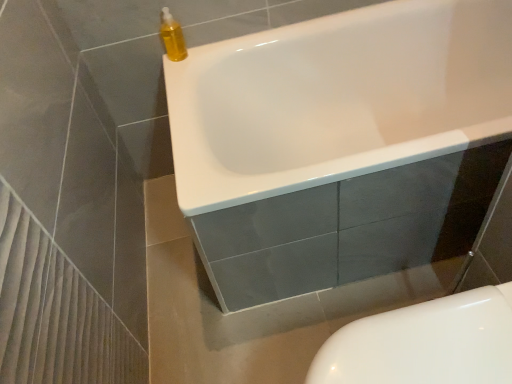
Question: Is yellow translucent bottle at upper left closer to camera compared to white glossy toilet at lower right?

Choices:
 (A) no
 (B) yes

Answer: (A)

Question: Does yellow translucent bottle at upper left appear on the left side of white glossy toilet at lower right?

Choices:
 (A) no
 (B) yes

Answer: (B)

Question: From a real-world perspective, is yellow translucent bottle at upper left on white glossy toilet at lower right?

Choices:
 (A) yes
 (B) no

Answer: (A)

Question: Is there a large distance between yellow translucent bottle at upper left and white glossy toilet at lower right?

Choices:
 (A) yes
 (B) no

Answer: (A)

Question: Is white glossy toilet at lower right inside yellow translucent bottle at upper left?

Choices:
 (A) yes
 (B) no

Answer: (B)

Question: Is yellow translucent bottle at upper left wider than white glossy toilet at lower right?

Choices:
 (A) yes
 (B) no

Answer: (B)

Question: Does white glossy bathtub at upper center lie in front of yellow translucent bottle at upper left?

Choices:
 (A) yes
 (B) no

Answer: (A)

Question: Is white glossy bathtub at upper center to the left of yellow translucent bottle at upper left from the viewer's perspective?

Choices:
 (A) no
 (B) yes

Answer: (A)

Question: Is white glossy bathtub at upper center smaller than yellow translucent bottle at upper left?

Choices:
 (A) no
 (B) yes

Answer: (A)

Question: Considering the relative sizes of white glossy bathtub at upper center and yellow translucent bottle at upper left in the image provided, is white glossy bathtub at upper center taller than yellow translucent bottle at upper left?

Choices:
 (A) yes
 (B) no

Answer: (A)

Question: Is yellow translucent bottle at upper left completely or partially inside white glossy bathtub at upper center?

Choices:
 (A) yes
 (B) no

Answer: (B)

Question: Is white glossy bathtub at upper center positioned behind yellow translucent bottle at upper left?

Choices:
 (A) yes
 (B) no

Answer: (B)

Question: Is yellow translucent bottle at upper left shorter than white glossy bathtub at upper center?

Choices:
 (A) no
 (B) yes

Answer: (B)